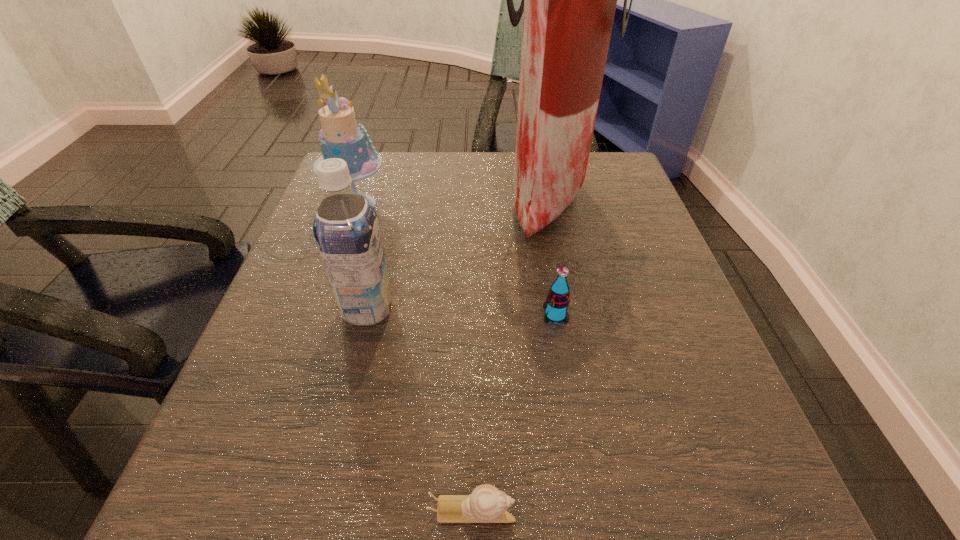
This screenshot has height=540, width=960. I want to click on free space between the nearest object and the cake, so point(415,357).

This screenshot has width=960, height=540. I want to click on free space between the soya milk and the grocery bag, so click(458, 253).

The image size is (960, 540). What are the coordinates of `free space between the escargot and the tallest object` in the screenshot? It's located at (510, 354).

Identify the location of the third closest object relative to the nearest object. The height and width of the screenshot is (540, 960). (569, 0).

You are a GUI agent. You are given a task and a screenshot of the screen. Output one action in this format:
    pyautogui.click(x=<x>, y=<y>)
    Task: Click on the object that is the nearest to the grocery bag
    The width and height of the screenshot is (960, 540).
    Given the screenshot: What is the action you would take?
    pyautogui.click(x=557, y=301)

Locate an element on the screen. This screenshot has width=960, height=540. free spot that satisfies the following two spatial constraints: 1. on the front side of the tallest object; 2. on the label of the soya milk is located at coordinates (569, 309).

You are a GUI agent. You are given a task and a screenshot of the screen. Output one action in this format:
    pyautogui.click(x=<x>, y=<y>)
    Task: Click on the free space that satisfies the following two spatial constraints: 1. with a ladder on the side of the second shortest object; 2. on the right side of the cake
    
    Given the screenshot: What is the action you would take?
    pyautogui.click(x=319, y=315)

Where is `free space that satisfies the following two spatial constraints: 1. with a ladder on the side of the cake; 2. on the left side of the fourth tallest object`? free space that satisfies the following two spatial constraints: 1. with a ladder on the side of the cake; 2. on the left side of the fourth tallest object is located at coordinates (319, 315).